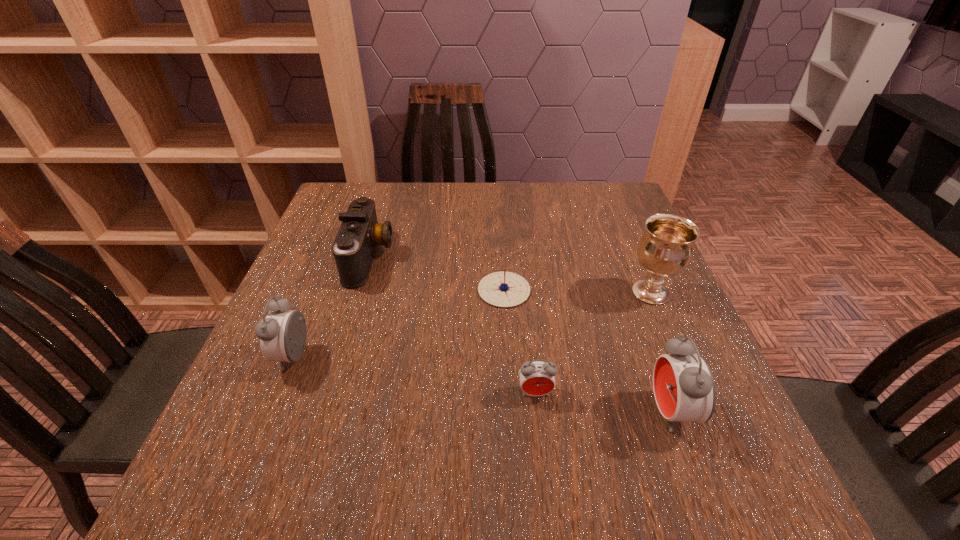
Where is `the farthest alarm clock`? the farthest alarm clock is located at coordinates (282, 334).

Where is `the leftmost alarm clock`? the leftmost alarm clock is located at coordinates (282, 334).

At what (x,y) coordinates should I click in order to perform the action: click on the second alarm clock from right to left. Please return your answer as a coordinate pair (x, y). The image size is (960, 540). Looking at the image, I should click on (537, 378).

Find the location of `the second shortest object`. the second shortest object is located at coordinates (537, 378).

What are the coordinates of `the rightmost alarm clock` in the screenshot? It's located at (684, 388).

Image resolution: width=960 pixels, height=540 pixels. I want to click on the second object from left to right, so click(354, 248).

Identify the location of compass. (504, 289).

Locate an element on the screen. chalice is located at coordinates (665, 249).

Find the location of a particular element. vacant area located 0.050m on the face of the fourth farthest object is located at coordinates (254, 357).

The height and width of the screenshot is (540, 960). What are the coordinates of `free region located 0.070m on the face of the shortest alarm clock` in the screenshot? It's located at (540, 437).